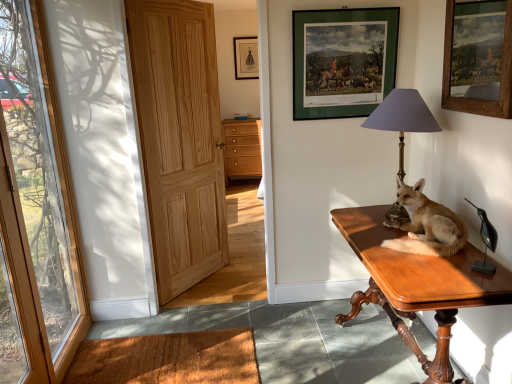
The image size is (512, 384). I want to click on vacant space that's between brown fur stuffed fox at right and black glossy bird at right, so click(456, 264).